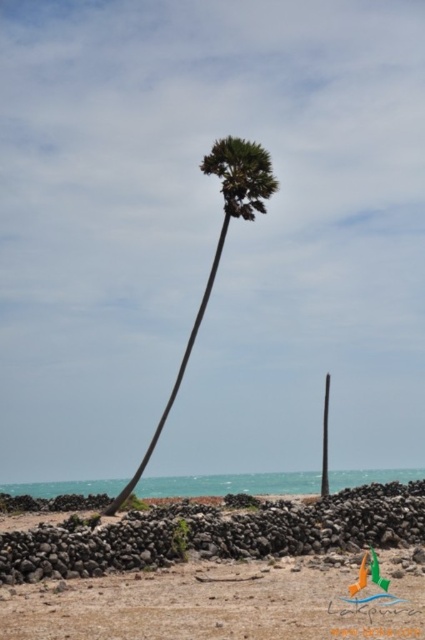
Who is lower down, brown sandy beach at lower center or green leafy palm tree at center?

brown sandy beach at lower center

Does point (5, 593) lie behind point (266, 180)?

No.

You are a GUI agent. You are given a task and a screenshot of the screen. Output one action in this format:
    pyautogui.click(x=<x>, y=<y>)
    Task: Click on the brown sandy beach at lower center
    Image resolution: width=425 pixels, height=640 pixels.
    Given the screenshot: What is the action you would take?
    pyautogui.click(x=217, y=602)

I want to click on brown sandy beach at lower center, so 217,602.

Which is in front, point (133, 483) or point (323, 458)?

Positioned in front is point (133, 483).

Between green leafy palm tree at center and green smooth pole at center, which one has less height?

Standing shorter between the two is green smooth pole at center.

Which is behind, point (257, 170) or point (325, 397)?

The point (325, 397) is behind.

Where is `green leafy palm tree at center`? The height and width of the screenshot is (640, 425). green leafy palm tree at center is located at coordinates (218, 243).

Is point (397, 609) farther from camera compared to point (323, 428)?

That is False.

Who is more distant from viewer, [102,637] or [325,442]?

The point [325,442] is more distant.

This screenshot has width=425, height=640. What are the coordinates of `brown sandy beach at lower center` in the screenshot? It's located at (217, 602).

At what (x,y) coordinates should I click in order to perform the action: click on brown sandy beach at lower center. Please return your answer as a coordinate pair (x, y). Image resolution: width=425 pixels, height=640 pixels. Looking at the image, I should click on (217, 602).